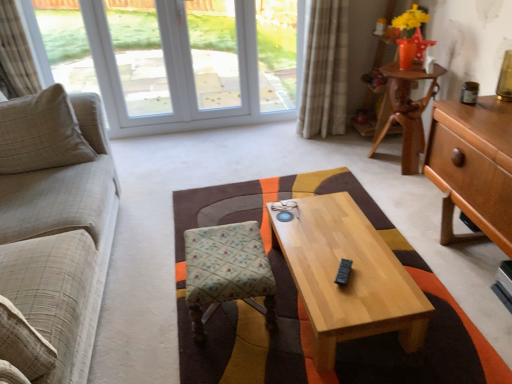
The width and height of the screenshot is (512, 384). What are the coordinates of `free space in front of plaid fabric curtain at upper right, the 2th curtain in the left-to-right sequence` in the screenshot? It's located at (322, 150).